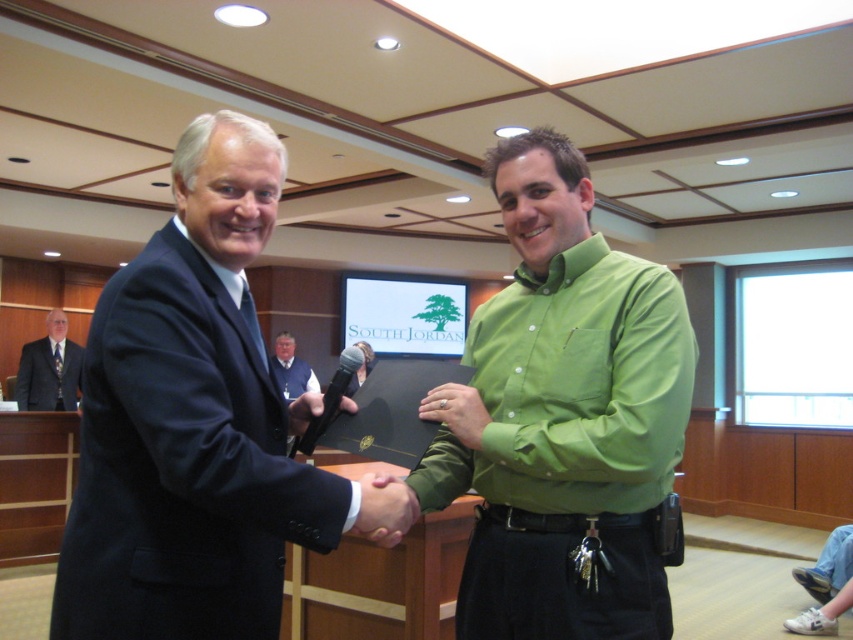
Find the location of a particular element. This screenshot has width=853, height=640. green matte hand at center is located at coordinates (384, 509).

This screenshot has height=640, width=853. I want to click on green matte hand at center, so click(x=384, y=509).

Does dark blue suit at center appear on the right side of matte black folder at center?

Correct, you'll find dark blue suit at center to the right of matte black folder at center.

Is dark blue suit at center closer to camera compared to matte black folder at center?

Yes, dark blue suit at center is closer to the viewer.

The height and width of the screenshot is (640, 853). I want to click on dark blue suit at center, so click(192, 422).

Does dark gray suit at center have a greater height compared to vest at center?

Correct, dark gray suit at center is much taller as vest at center.

I want to click on dark gray suit at center, so click(49, 369).